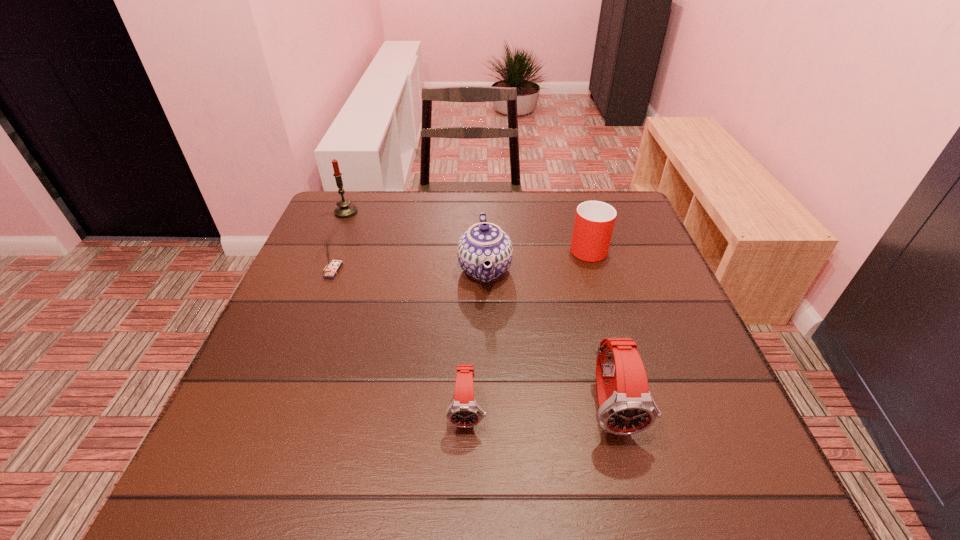
Observe the arrangement of all watchs in the image. To keep them evenly spaced, where would you place another watch on the left? Please locate a free space. Please provide its 2D coordinates. Your answer should be formatted as a tuple, i.e. [(x, y)], where the tuple contains the x and y coordinates of a point satisfying the conditions above.

[(322, 412)]